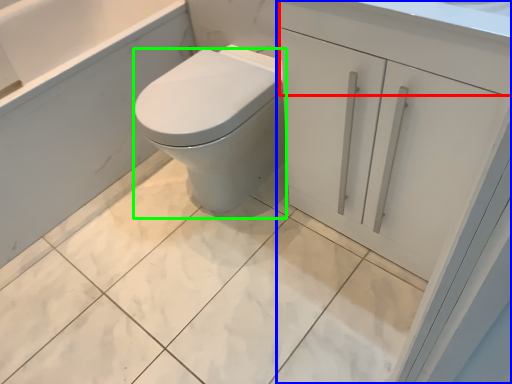
Question: Based on their relative distances, which object is farther from drawer (highlighted by a red box)? Choose from bathroom cabinet (highlighted by a blue box) and bidet (highlighted by a green box).

Choices:
 (A) bathroom cabinet
 (B) bidet

Answer: (B)